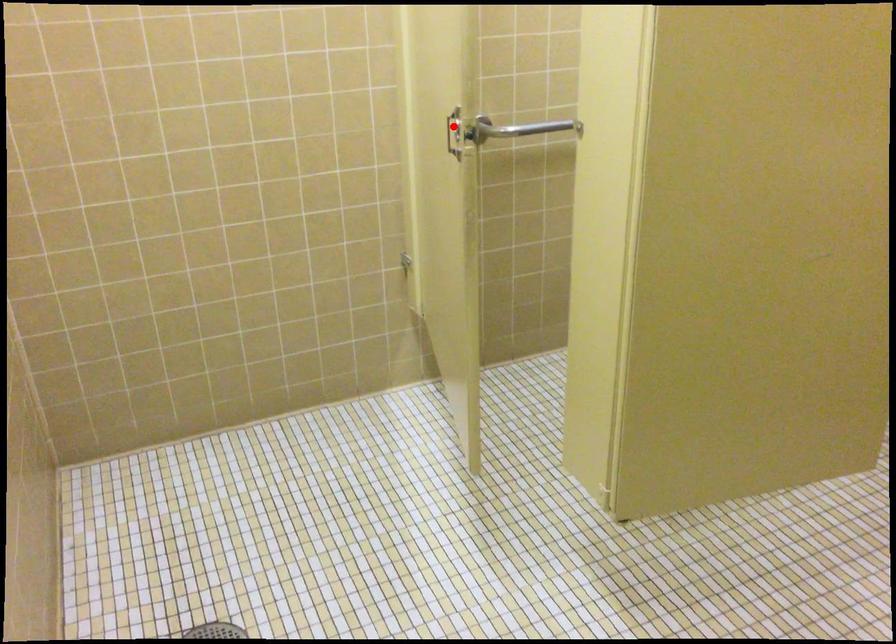
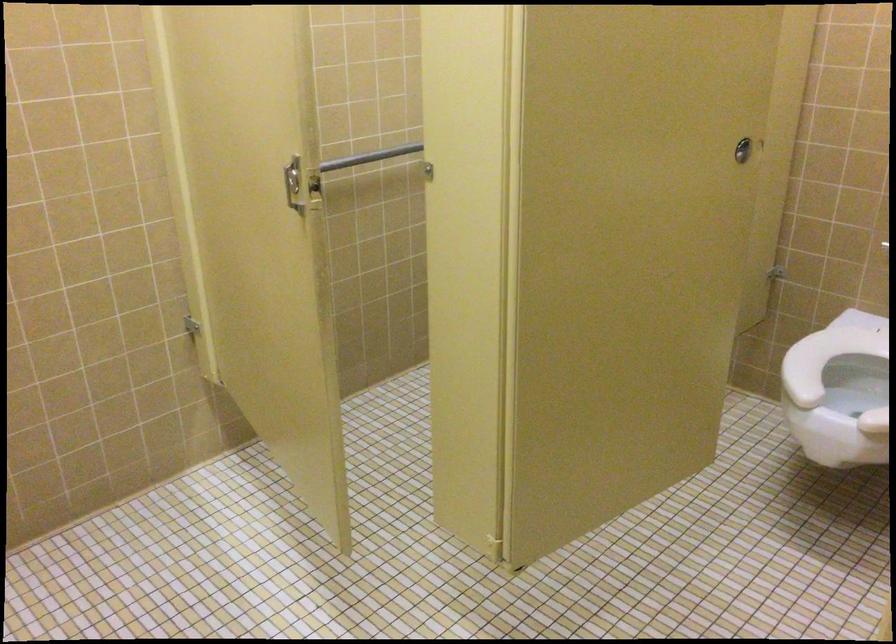
In the second image, find the point that corresponds to the highlighted location in the first image.

(293, 184)